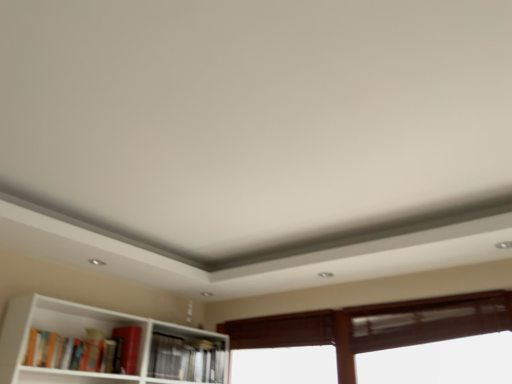
Question: Is hardcover book at lower left, which is the first book in left-to-right order, facing towards hardcover book at center, the 2th book from the front?

Choices:
 (A) no
 (B) yes

Answer: (A)

Question: Can you confirm if hardcover book at lower left, the second book viewed from the right, is shorter than hardcover book at center, acting as the 1th book starting from the right?

Choices:
 (A) yes
 (B) no

Answer: (A)

Question: Is hardcover book at lower left, which is the 1th book from front to back, in contact with hardcover book at center, arranged as the 2th book when viewed from the left?

Choices:
 (A) yes
 (B) no

Answer: (B)

Question: From the image's perspective, is hardcover book at lower left, the 2th book viewed from the back, located above hardcover book at center, the 1th book positioned from the back?

Choices:
 (A) yes
 (B) no

Answer: (A)

Question: From a real-world perspective, is hardcover book at lower left, which is the 1th book from front to back, located higher than hardcover book at center, the 2th book from the front?

Choices:
 (A) yes
 (B) no

Answer: (A)

Question: Considering the positions of hardcover book at lower left, the 2th book viewed from the back, and hardcover book at center, the 1th book positioned from the back, in the image, is hardcover book at lower left, the 2th book viewed from the back, bigger or smaller than hardcover book at center, the 1th book positioned from the back,?

Choices:
 (A) big
 (B) small

Answer: (A)

Question: Relative to hardcover book at center, the 2th book from the front, is hardcover book at lower left, the 2th book viewed from the back, in front or behind?

Choices:
 (A) behind
 (B) front

Answer: (B)

Question: Based on their positions, is hardcover book at lower left, the 2th book viewed from the back, located to the left or right of hardcover book at center, the 2th book from the front?

Choices:
 (A) right
 (B) left

Answer: (B)

Question: From the image's perspective, is hardcover book at lower left, the 2th book viewed from the back, positioned above or below hardcover book at center, the 2th book from the front?

Choices:
 (A) below
 (B) above

Answer: (B)

Question: In terms of size, does hardcover book at center, the 2th book from the front, appear bigger or smaller than brown wooden window at lower right?

Choices:
 (A) small
 (B) big

Answer: (A)

Question: From their relative heights in the image, would you say hardcover book at center, the 2th book from the front, is taller or shorter than brown wooden window at lower right?

Choices:
 (A) short
 (B) tall

Answer: (A)

Question: From the image's perspective, is hardcover book at center, the 2th book from the front, positioned above or below brown wooden window at lower right?

Choices:
 (A) above
 (B) below

Answer: (B)

Question: Considering the relative positions of hardcover book at center, arranged as the 2th book when viewed from the left, and brown wooden window at lower right in the image provided, is hardcover book at center, arranged as the 2th book when viewed from the left, to the left or to the right of brown wooden window at lower right?

Choices:
 (A) right
 (B) left

Answer: (B)

Question: Visually, is brown wooden window at lower right positioned to the left or to the right of hardcover book at lower left, which is the first book in left-to-right order?

Choices:
 (A) left
 (B) right

Answer: (B)

Question: Looking at their shapes, would you say brown wooden window at lower right is wider or thinner than hardcover book at lower left, which is the 1th book from front to back?

Choices:
 (A) thin
 (B) wide

Answer: (A)